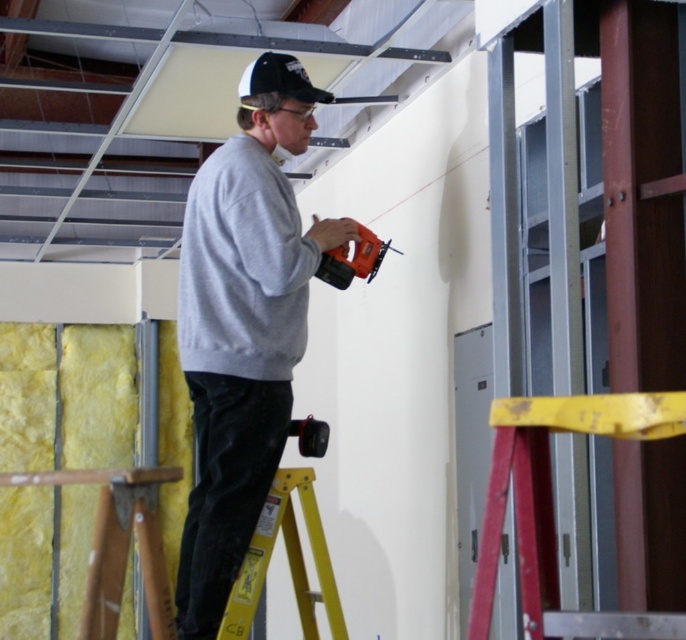
Question: Which of the following is the closest to the observer?

Choices:
 (A) (305, 604)
 (B) (322, 99)
 (C) (289, 298)

Answer: (A)

Question: Can you confirm if gray sweatshirt at center is smaller than orange plastic drill at center?

Choices:
 (A) no
 (B) yes

Answer: (A)

Question: Is gray matte sweatshirt at center wider than yellow/yellowish metal ladder at lower center?

Choices:
 (A) yes
 (B) no

Answer: (A)

Question: Estimate the real-world distances between objects in this image. Which object is closer to the yellow wood at lower left?

Choices:
 (A) gray matte sweatshirt at center
 (B) orange plastic drill at center
 (C) black fabric baseball cap at upper center

Answer: (A)

Question: Does gray matte sweatshirt at center appear on the right side of orange plastic drill at center?

Choices:
 (A) no
 (B) yes

Answer: (A)

Question: Considering the real-world distances, which object is farthest from the yellow wood at lower left?

Choices:
 (A) gray matte sweatshirt at center
 (B) black fabric baseball cap at upper center
 (C) orange plastic drill at center
 (D) yellow/yellowish metal ladder at lower center

Answer: (B)